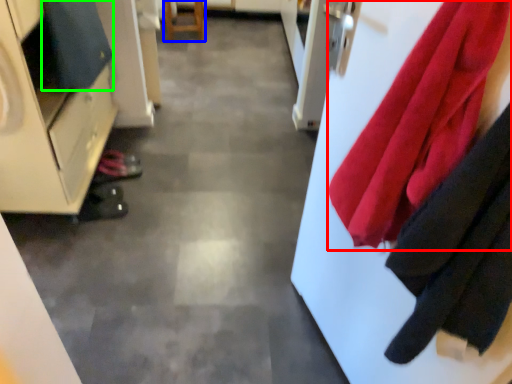
Question: Estimate the real-world distances between objects in this image. Which object is closer to cloth (highlighted by a red box), furniture (highlighted by a blue box) or cloak (highlighted by a green box)?

Choices:
 (A) furniture
 (B) cloak

Answer: (B)